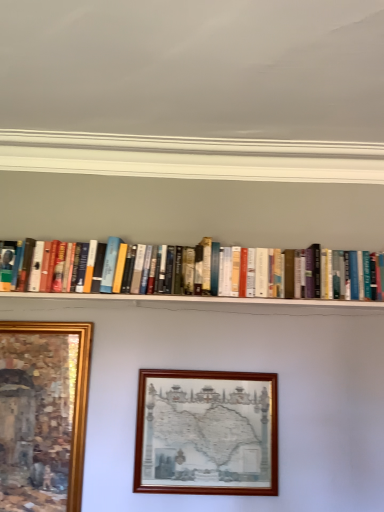
Question: Considering the positions of gold-framed painting at lower left, the 2th picture frame viewed from the right, and hardcover books at center in the image, is gold-framed painting at lower left, the 2th picture frame viewed from the right, wider or thinner than hardcover books at center?

Choices:
 (A) thin
 (B) wide

Answer: (A)

Question: Relative to hardcover books at center, is gold-framed painting at lower left, the 2th picture frame viewed from the right, in front or behind?

Choices:
 (A) front
 (B) behind

Answer: (A)

Question: Which object is positioned farthest from the wooden picture frame at center, which is the second picture frame in left-to-right order?

Choices:
 (A) gold-framed painting at lower left, the 2th picture frame viewed from the right
 (B) hardcover books at center

Answer: (B)

Question: Which of these objects is positioned closest to the hardcover books at center?

Choices:
 (A) wooden picture frame at center, placed as the 1th picture frame when sorted from right to left
 (B) gold-framed painting at lower left, the 2th picture frame viewed from the right

Answer: (A)